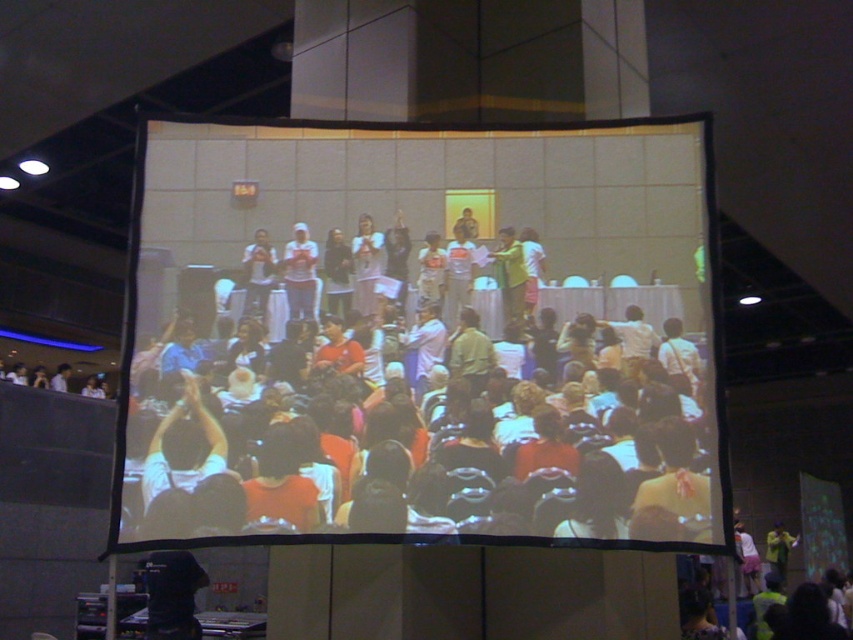
In the scene shown: You are organizing a photo shoot and need to arrange two shirts from the image for a display. The white matte shirt at center and the yellow fabric shirt at center must be placed side by side. Which shirt should you place on the left to ensure the display looks balanced?

The white matte shirt at center is thinner than the yellow fabric shirt at center, so placing the thinner white matte shirt at center on the left and the thicker yellow fabric shirt at center on the right will create a balanced display.

You are standing in front of the projection screen and want to see the point at coordinates (299,307) on the screen. If you are currently 13.66 feet away from the screen, can you clearly see the details at that point?

The point at coordinates (299,307) is 13.66 feet away from you, which is the same distance as your current position. Therefore, you are at the optimal distance to clearly see the details at that point.